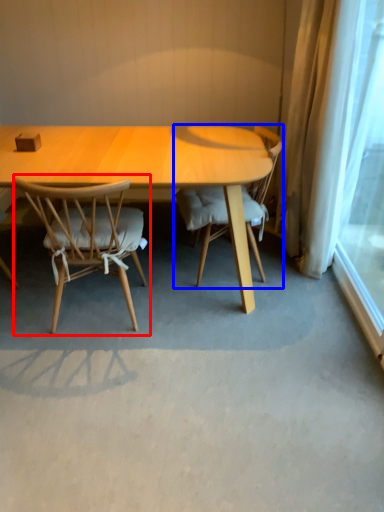
Question: Which object appears closest to the camera in this image, chair (highlighted by a red box) or chair (highlighted by a blue box)?

Choices:
 (A) chair
 (B) chair

Answer: (A)